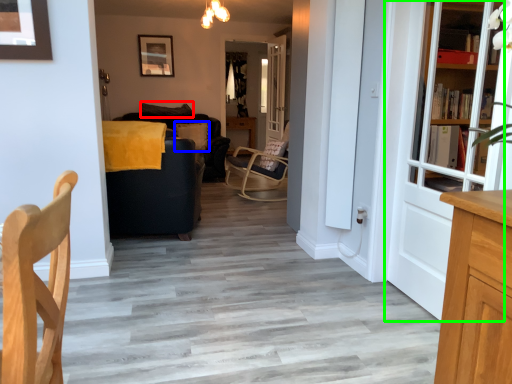
Question: Considering the real-world distances, which object is closest to pillow (highlighted by a red box)? pillow (highlighted by a blue box) or door (highlighted by a green box).

Choices:
 (A) pillow
 (B) door

Answer: (A)